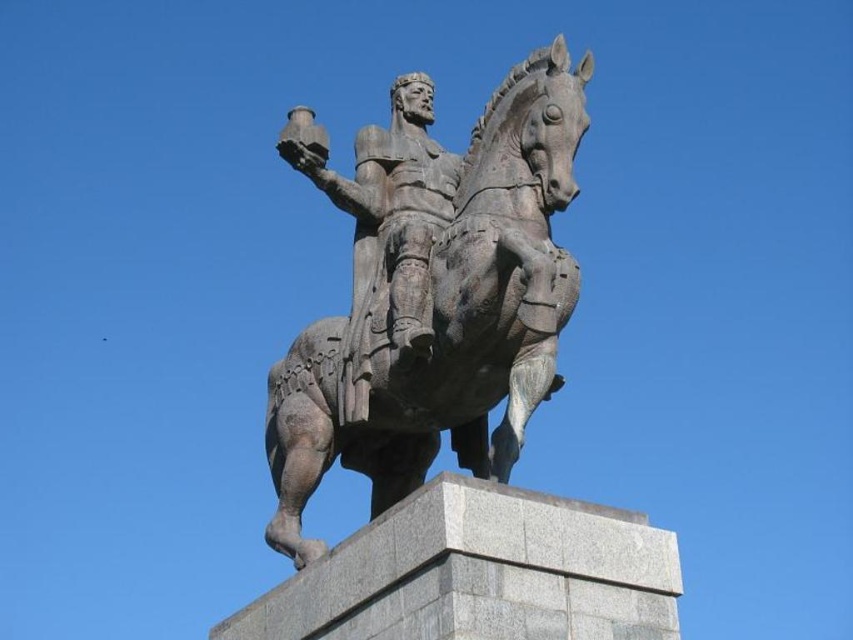
Question: Can you confirm if bronze statue at center is smaller than bronze armor at center?

Choices:
 (A) yes
 (B) no

Answer: (A)

Question: Which point appears closest to the camera in this image?

Choices:
 (A) (418, 307)
 (B) (387, 228)

Answer: (A)

Question: Does bronze statue at center appear under bronze armor at center?

Choices:
 (A) no
 (B) yes

Answer: (B)

Question: Is bronze statue at center to the right of bronze armor at center from the viewer's perspective?

Choices:
 (A) yes
 (B) no

Answer: (A)